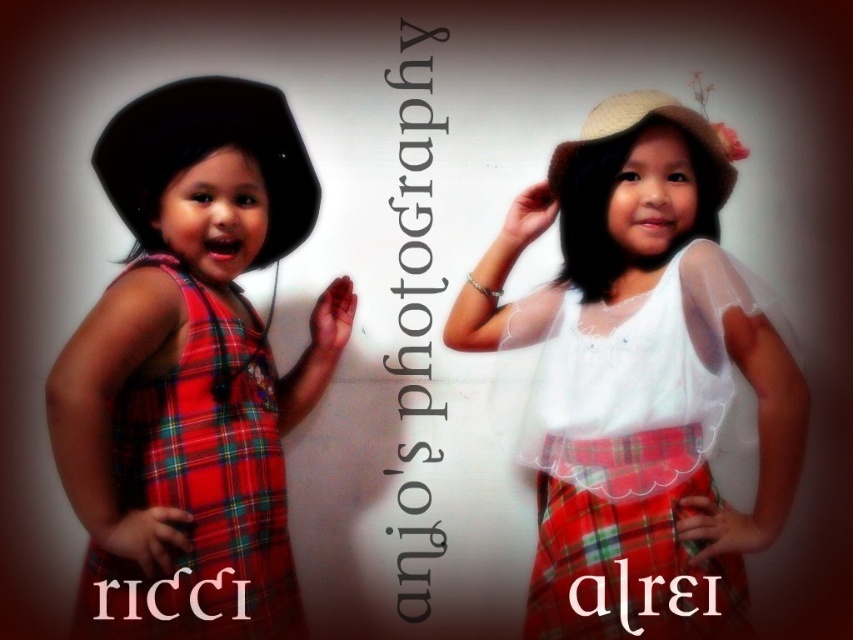
Can you confirm if matte plaid dress at left is positioned above red plaid kilt at lower right?

Yes.

Who is lower down, matte plaid dress at left or red plaid kilt at lower right?

red plaid kilt at lower right is lower down.

Who is more forward, (300, 620) or (664, 502)?

Point (664, 502) is in front.

Identify the location of matte plaid dress at left. This screenshot has width=853, height=640. (190, 371).

Does matte white blouse at center appear over red plaid kilt at lower right?

Yes, matte white blouse at center is above red plaid kilt at lower right.

Who is lower down, matte white blouse at center or red plaid kilt at lower right?

red plaid kilt at lower right is lower down.

Describe the element at coordinates (639, 378) in the screenshot. The width and height of the screenshot is (853, 640). I see `matte white blouse at center` at that location.

Where is `matte white blouse at center`? matte white blouse at center is located at coordinates (639, 378).

Does point (456, 316) lie in front of point (183, 573)?

That is False.

Which is more to the left, matte white blouse at center or matte plaid dress at left?

matte plaid dress at left

This screenshot has width=853, height=640. Find the location of `matte white blouse at center`. matte white blouse at center is located at coordinates (639, 378).

Where is `matte white blouse at center`? The height and width of the screenshot is (640, 853). matte white blouse at center is located at coordinates pos(639,378).